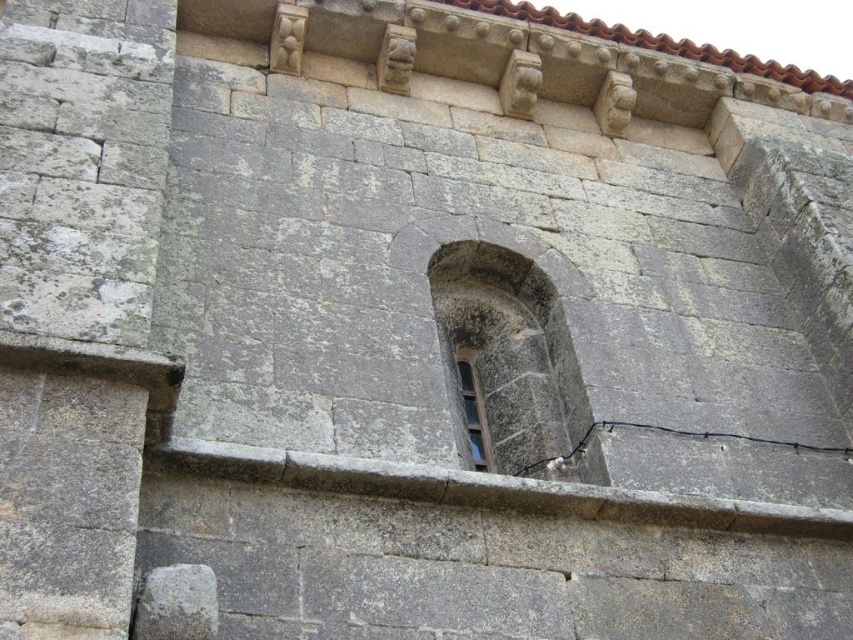
You are standing in front of the historical stone building and notice two points marked on the wall. The first point is at coordinate point [727,436] and the second at point [469,372]. Which point is closer to your eyes?

Point [727,436] is closer to the camera than point [469,372].

You are an electrician working on the stone building. You need to install a new light fixture near the arched window. There is a black rubber wire marked at point (666, 433). Where exactly is this wire located in relation to the arched window?

The black rubber wire at point (666, 433) is located at the lower center relative to the arched window.

You are an electrician working on the stone wall of a historical building. You need to install a new wire that must be placed exactly at the point where the black rubber wire at lower center is located. According to the image, what are the coordinates of this point?

The coordinates of the black rubber wire at lower center are at point [666,433].